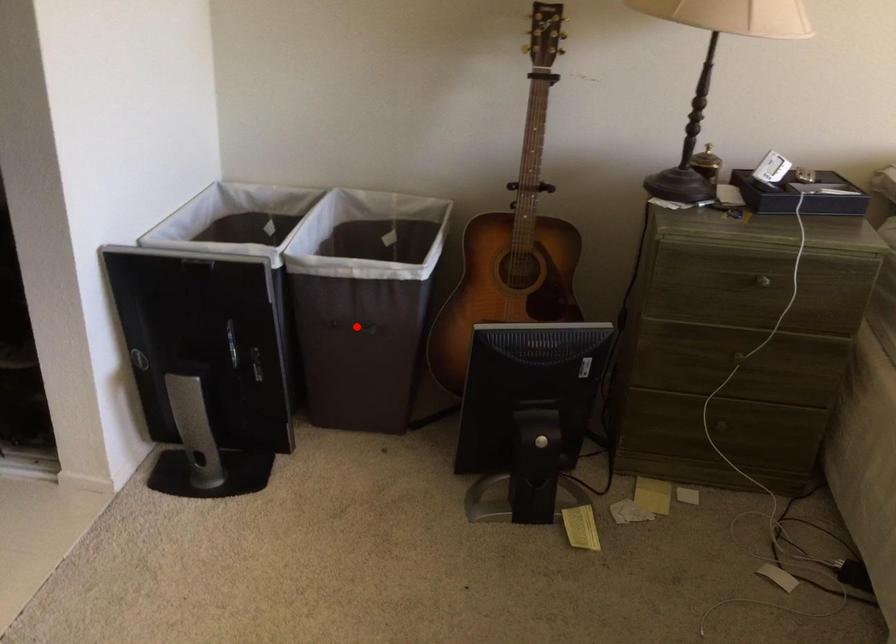
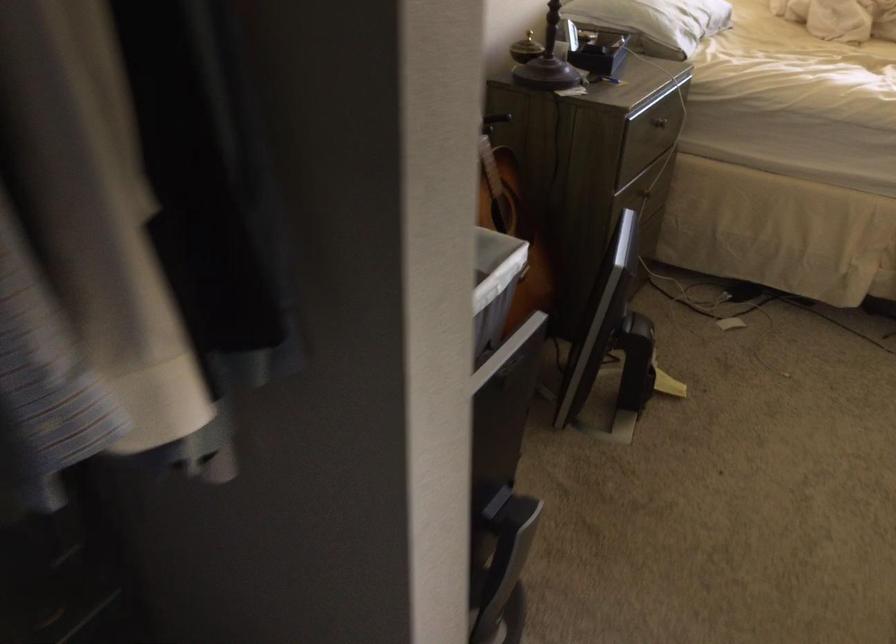
Question: I am providing you with two images of the same scene from different viewpoints. A red point is marked on the first image. Can you still see the location of the red point in image 2?

Choices:
 (A) Yes
 (B) No

Answer: (B)